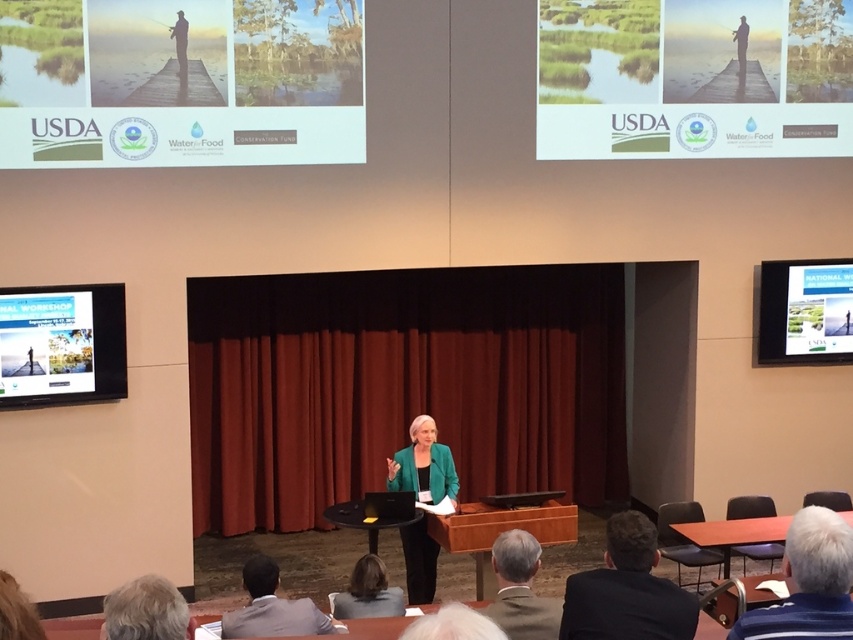
Looking at this image, is gray striped shirt at lower right behind smooth brown hair at lower center?

No, gray striped shirt at lower right is closer to the viewer.

I want to click on gray striped shirt at lower right, so click(808, 582).

This screenshot has height=640, width=853. I want to click on gray striped shirt at lower right, so click(808, 582).

Where is `gray striped shirt at lower right`? gray striped shirt at lower right is located at coordinates (808, 582).

Locate an element on the screen. white glossy screen at upper right is located at coordinates (802, 312).

Which is more to the left, white glossy screen at upper right or green fabric jacket at center?

green fabric jacket at center

Is point (828, 260) positioned before point (428, 589)?

That is False.

Identify the location of white glossy screen at upper right. (802, 312).

Is black velvet curtain at center above dark brown leather jacket at lower left?

Yes.

Who is higher up, black velvet curtain at center or dark brown leather jacket at lower left?

black velvet curtain at center is above.

Describe the element at coordinates (401, 385) in the screenshot. This screenshot has width=853, height=640. I see `black velvet curtain at center` at that location.

At what (x,y) coordinates should I click in order to perform the action: click on black velvet curtain at center. Please return your answer as a coordinate pair (x, y). The width and height of the screenshot is (853, 640). Looking at the image, I should click on (401, 385).